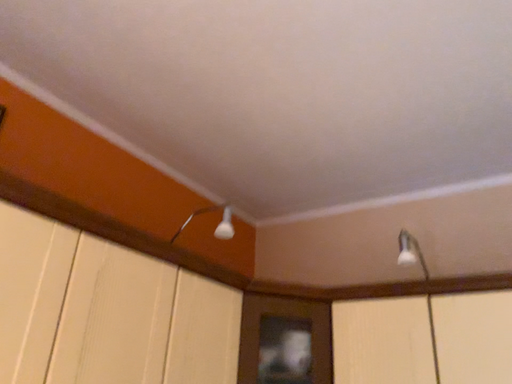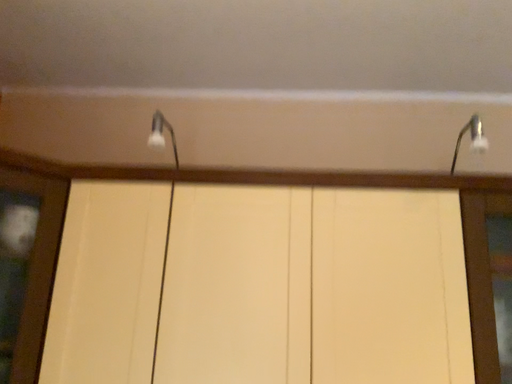
Question: How did the camera likely rotate when shooting the video?

Choices:
 (A) rotated right
 (B) rotated left

Answer: (A)